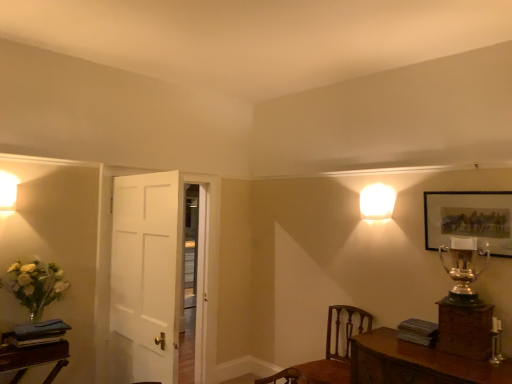
In order to click on free point above matte gold picture frame at upper right (from a real-world perspective) in this screenshot , I will do `click(465, 195)`.